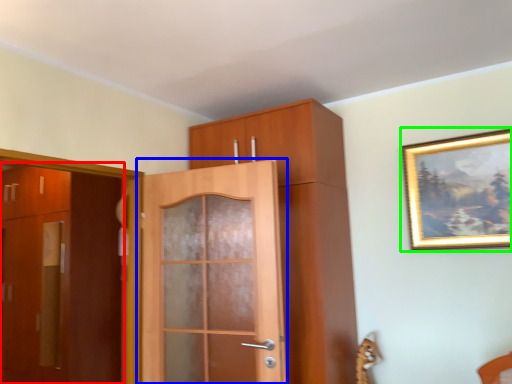
Question: Which object is positioned farthest from door (highlighted by a red box)? Select from door (highlighted by a blue box) and picture frame (highlighted by a green box).

Choices:
 (A) door
 (B) picture frame

Answer: (B)